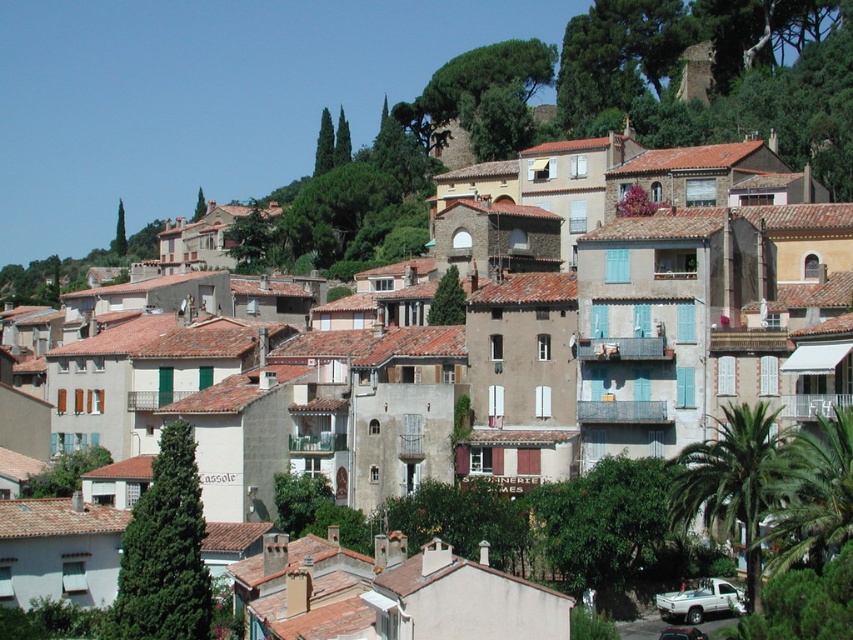
Is white matte truck at lower right above metallic silver car at lower center?

Correct, white matte truck at lower right is located above metallic silver car at lower center.

Between white matte truck at lower right and metallic silver car at lower center, which one is positioned lower?

metallic silver car at lower center is lower down.

Is point (698, 616) positioned behind point (659, 636)?

Yes, point (698, 616) is farther from viewer.

Locate an element on the screen. The image size is (853, 640). white matte truck at lower right is located at coordinates (699, 602).